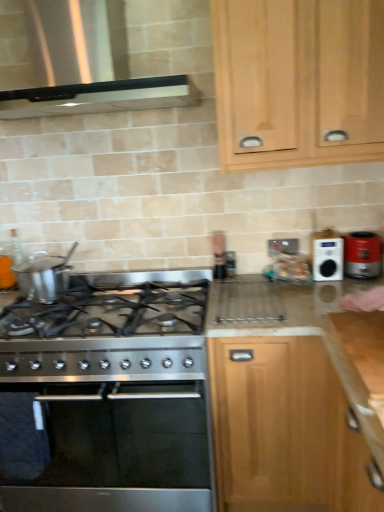
You are a GUI agent. You are given a task and a screenshot of the screen. Output one action in this format:
    pyautogui.click(x=<x>, y=<y>)
    Task: Click on the matte red toaster at right
    This screenshot has width=384, height=512.
    Given the screenshot: What is the action you would take?
    pyautogui.click(x=362, y=255)

Describe the element at coordinates (298, 82) in the screenshot. I see `light wood cabinet at upper right, positioned as the first cabinetry in top-to-bottom order` at that location.

This screenshot has height=512, width=384. Describe the element at coordinates (104, 447) in the screenshot. I see `stainless steel oven at lower left` at that location.

Measure the distance between stainless steel oven at lower left and camera.

stainless steel oven at lower left is 1.50 meters away from camera.

Locate an element on the screen. stainless steel vent at upper left is located at coordinates (98, 97).

The width and height of the screenshot is (384, 512). In order to click on white plastic radio at upper right in this screenshot , I will do `click(328, 258)`.

Where is `stainless steel gas stove at lower left`? The image size is (384, 512). stainless steel gas stove at lower left is located at coordinates 109,311.

Image resolution: width=384 pixels, height=512 pixels. Identify the location of matte red toaster at right. (362, 255).

Is light wood cabinet at center, positioned as the second cabinetry in top-to-bottom order, shorter than stainless steel oven at lower left?

No, light wood cabinet at center, positioned as the second cabinetry in top-to-bottom order, is not shorter than stainless steel oven at lower left.

What's the angular difference between light wood cabinet at center, positioned as the second cabinetry in top-to-bottom order, and stainless steel oven at lower left's facing directions?

The angular difference between light wood cabinet at center, positioned as the second cabinetry in top-to-bottom order, and stainless steel oven at lower left is 1.11 degrees.

Is point (255, 423) positioned before point (22, 405)?

No, (255, 423) is behind (22, 405).

Can we say light wood cabinet at center, placed as the first cabinetry when sorted from bottom to top, lies outside stainless steel oven at lower left?

Yes, light wood cabinet at center, placed as the first cabinetry when sorted from bottom to top, is not within stainless steel oven at lower left.

Find the location of `cabinetry located in front of the stainless steel gas stove at lower left`. cabinetry located in front of the stainless steel gas stove at lower left is located at coordinates coord(298,82).

Does stainless steel gas stove at lower left have a lesser width compared to light wood cabinet at upper right, the 2th cabinetry ordered from the bottom?

In fact, stainless steel gas stove at lower left might be wider than light wood cabinet at upper right, the 2th cabinetry ordered from the bottom.

Consider the image. From a real-world perspective, is stainless steel gas stove at lower left positioned over light wood cabinet at upper right, positioned as the first cabinetry in top-to-bottom order, based on gravity?

No, from a real-world perspective, stainless steel gas stove at lower left is not on top of light wood cabinet at upper right, positioned as the first cabinetry in top-to-bottom order.

Does stainless steel gas stove at lower left lie in front of light wood cabinet at upper right, positioned as the first cabinetry in top-to-bottom order?

That is False.

Is the position of stainless steel vent at upper left less distant than that of light wood cabinet at upper right, positioned as the first cabinetry in top-to-bottom order?

Yes, stainless steel vent at upper left is closer to the camera.

Is stainless steel vent at upper left touching light wood cabinet at upper right, positioned as the first cabinetry in top-to-bottom order?

No, stainless steel vent at upper left is not making contact with light wood cabinet at upper right, positioned as the first cabinetry in top-to-bottom order.

Who is bigger, stainless steel vent at upper left or light wood cabinet at upper right, positioned as the first cabinetry in top-to-bottom order?

With larger size is stainless steel vent at upper left.

Is stainless steel vent at upper left located outside light wood cabinet at upper right, the 2th cabinetry ordered from the bottom?

Yes, stainless steel vent at upper left is located beyond the bounds of light wood cabinet at upper right, the 2th cabinetry ordered from the bottom.

Can you tell me how much light wood cabinet at upper right, positioned as the first cabinetry in top-to-bottom order, and stainless steel oven at lower left differ in facing direction?

There is a 1.06-degree angle between the facing directions of light wood cabinet at upper right, positioned as the first cabinetry in top-to-bottom order, and stainless steel oven at lower left.

Is light wood cabinet at upper right, the 2th cabinetry ordered from the bottom, facing away from stainless steel oven at lower left?

No.

From the image's perspective, which is above, light wood cabinet at upper right, positioned as the first cabinetry in top-to-bottom order, or stainless steel oven at lower left?

light wood cabinet at upper right, positioned as the first cabinetry in top-to-bottom order, appears higher in the image.

Is light wood cabinet at upper right, positioned as the first cabinetry in top-to-bottom order, shorter than stainless steel oven at lower left?

No.

Is metallic silver outlet at upper center far from matte red toaster at right?

No, metallic silver outlet at upper center is not far from matte red toaster at right.

Is metallic silver outlet at upper center aimed at matte red toaster at right?

No, metallic silver outlet at upper center is not oriented towards matte red toaster at right.

Is metallic silver outlet at upper center inside the boundaries of matte red toaster at right, or outside?

metallic silver outlet at upper center exists outside the volume of matte red toaster at right.

You are a GUI agent. You are given a task and a screenshot of the screen. Output one action in this format:
    pyautogui.click(x=<x>, y=<y>)
    Task: Click on the kitchen appliance below the metallic silver outlet at upper center (from a real-world perspective)
    The height and width of the screenshot is (512, 384).
    Given the screenshot: What is the action you would take?
    pyautogui.click(x=362, y=255)

Between stainless steel oven at lower left and light wood cabinet at upper right, the 2th cabinetry ordered from the bottom, which one appears on the right side from the viewer's perspective?

light wood cabinet at upper right, the 2th cabinetry ordered from the bottom, is more to the right.

Are stainless steel oven at lower left and light wood cabinet at upper right, positioned as the first cabinetry in top-to-bottom order, far apart?

Indeed, stainless steel oven at lower left is not near light wood cabinet at upper right, positioned as the first cabinetry in top-to-bottom order.

In the scene shown: Which of these two, stainless steel oven at lower left or light wood cabinet at upper right, the 2th cabinetry ordered from the bottom, stands shorter?

With less height is stainless steel oven at lower left.

Would you say stainless steel oven at lower left is outside light wood cabinet at upper right, positioned as the first cabinetry in top-to-bottom order?

That's correct, stainless steel oven at lower left is outside of light wood cabinet at upper right, positioned as the first cabinetry in top-to-bottom order.

Does white plastic radio at upper right have a greater height compared to stainless steel oven at lower left?

No.

Can you tell me how much white plastic radio at upper right and stainless steel oven at lower left differ in facing direction?

The facing directions of white plastic radio at upper right and stainless steel oven at lower left are 2.21 degrees apart.

Which object is positioned more to the right, white plastic radio at upper right or stainless steel oven at lower left?

From the viewer's perspective, white plastic radio at upper right appears more on the right side.

Is white plastic radio at upper right in front of or behind stainless steel oven at lower left in the image?

white plastic radio at upper right is positioned farther from the viewer than stainless steel oven at lower left.

You are a GUI agent. You are given a task and a screenshot of the screen. Output one action in this format:
    pyautogui.click(x=<x>, y=<y>)
    Task: Click on the oven below the light wood cabinet at center, positioned as the second cabinetry in top-to-bottom order (from a real-world perspective)
    
    Given the screenshot: What is the action you would take?
    pyautogui.click(x=104, y=447)

You are a GUI agent. You are given a task and a screenshot of the screen. Output one action in this format:
    pyautogui.click(x=<x>, y=<y>)
    Task: Click on the gas stove on the left of the light wood cabinet at upper right, the 2th cabinetry ordered from the bottom
    The image size is (384, 512).
    Given the screenshot: What is the action you would take?
    pyautogui.click(x=109, y=311)

Estimate the real-world distances between objects in this image. Which object is further from stainless steel oven at lower left, light wood cabinet at upper right, positioned as the first cabinetry in top-to-bottom order, or white plastic radio at upper right?

Among the two, light wood cabinet at upper right, positioned as the first cabinetry in top-to-bottom order, is located further to stainless steel oven at lower left.

Based on their spatial positions, is matte red toaster at right or light wood cabinet at upper right, the 2th cabinetry ordered from the bottom, further from light wood cabinet at center, positioned as the second cabinetry in top-to-bottom order?

light wood cabinet at upper right, the 2th cabinetry ordered from the bottom, is further to light wood cabinet at center, positioned as the second cabinetry in top-to-bottom order.

Estimate the real-world distances between objects in this image. Which object is closer to matte red toaster at right, stainless steel gas stove at lower left or light wood cabinet at upper right, positioned as the first cabinetry in top-to-bottom order?

light wood cabinet at upper right, positioned as the first cabinetry in top-to-bottom order, is closer to matte red toaster at right.

Which object lies nearer to the anchor point stainless steel vent at upper left, white plastic radio at upper right or light wood cabinet at upper right, the 2th cabinetry ordered from the bottom?

light wood cabinet at upper right, the 2th cabinetry ordered from the bottom.

Which object lies nearer to the anchor point light wood cabinet at upper right, the 2th cabinetry ordered from the bottom, matte red toaster at right or stainless steel oven at lower left?

The object closer to light wood cabinet at upper right, the 2th cabinetry ordered from the bottom, is matte red toaster at right.

Looking at the image, which one is located further to stainless steel gas stove at lower left, stainless steel oven at lower left or light wood cabinet at center, positioned as the second cabinetry in top-to-bottom order?

Based on the image, stainless steel oven at lower left appears to be further to stainless steel gas stove at lower left.

Based on their spatial positions, is metallic silver outlet at upper center or stainless steel vent at upper left closer to white plastic radio at upper right?

The object closer to white plastic radio at upper right is metallic silver outlet at upper center.

Considering their positions, is white plastic radio at upper right positioned closer to matte red toaster at right than stainless steel oven at lower left?

white plastic radio at upper right is positioned closer to the anchor matte red toaster at right.

In order to click on appliance between metallic silver outlet at upper center and light wood cabinet at center, placed as the first cabinetry when sorted from bottom to top, in the vertical direction in this screenshot , I will do `click(328, 258)`.

This screenshot has height=512, width=384. Identify the location of appliance located between metallic silver outlet at upper center and matte red toaster at right in the left-right direction. (328, 258).

This screenshot has height=512, width=384. Find the location of `appliance between light wood cabinet at upper right, the 2th cabinetry ordered from the bottom, and light wood cabinet at center, placed as the first cabinetry when sorted from bottom to top, in the vertical direction`. appliance between light wood cabinet at upper right, the 2th cabinetry ordered from the bottom, and light wood cabinet at center, placed as the first cabinetry when sorted from bottom to top, in the vertical direction is located at coordinates (328, 258).

Find the location of a particular element. electric outlet between light wood cabinet at upper right, positioned as the first cabinetry in top-to-bottom order, and light wood cabinet at center, placed as the first cabinetry when sorted from bottom to top, vertically is located at coordinates (282, 246).